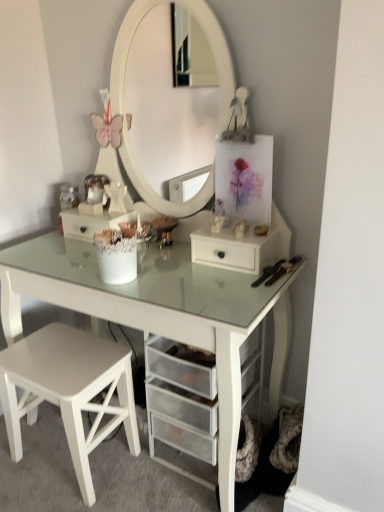
Question: Can you confirm if white matte stool at lower left is shorter than white matte drawer at center?

Choices:
 (A) yes
 (B) no

Answer: (B)

Question: Does white matte stool at lower left have a lesser width compared to white matte drawer at center?

Choices:
 (A) no
 (B) yes

Answer: (A)

Question: Does white matte stool at lower left have a greater height compared to white matte drawer at center?

Choices:
 (A) yes
 (B) no

Answer: (A)

Question: Considering the relative sizes of white matte stool at lower left and white matte drawer at center in the image provided, is white matte stool at lower left smaller than white matte drawer at center?

Choices:
 (A) yes
 (B) no

Answer: (B)

Question: From a real-world perspective, is white matte stool at lower left below white matte drawer at center?

Choices:
 (A) yes
 (B) no

Answer: (A)

Question: Is white matte stool at lower left further to camera compared to white matte drawer at center?

Choices:
 (A) yes
 (B) no

Answer: (B)

Question: From a real-world perspective, is white mesh drawer at center on top of white matte drawer at center?

Choices:
 (A) no
 (B) yes

Answer: (B)

Question: Is white mesh drawer at center far away from white matte drawer at center?

Choices:
 (A) no
 (B) yes

Answer: (A)

Question: Considering the relative positions of white mesh drawer at center and white matte drawer at center in the image provided, is white mesh drawer at center to the left of white matte drawer at center from the viewer's perspective?

Choices:
 (A) yes
 (B) no

Answer: (A)

Question: Is white mesh drawer at center facing towards white matte drawer at center?

Choices:
 (A) no
 (B) yes

Answer: (A)

Question: From the image's perspective, is white mesh drawer at center beneath white matte drawer at center?

Choices:
 (A) yes
 (B) no

Answer: (B)

Question: From the image's perspective, would you say white mesh drawer at center is positioned over white matte drawer at center?

Choices:
 (A) no
 (B) yes

Answer: (B)

Question: From a real-world perspective, is white matte drawer at center below white matte stool at lower left?

Choices:
 (A) yes
 (B) no

Answer: (B)